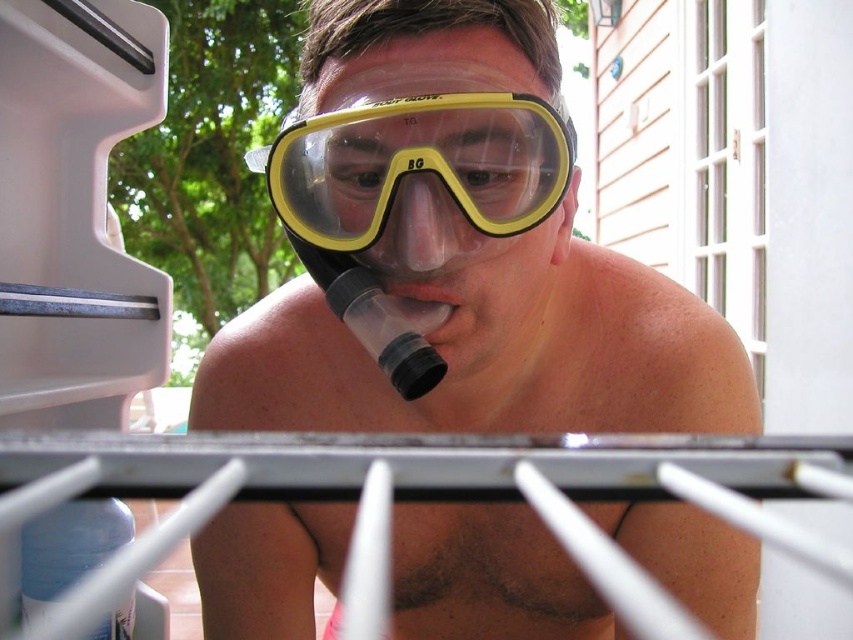
Is yellow clear plastic goggles at center closer to camera compared to translucent rubber nose at center?

No, it is behind translucent rubber nose at center.

Is yellow clear plastic goggles at center to the left of translucent rubber nose at center from the viewer's perspective?

Yes, yellow clear plastic goggles at center is to the left of translucent rubber nose at center.

Identify the location of yellow clear plastic goggles at center. The image size is (853, 640). (418, 164).

Which is more to the right, yellow matte snorkel mask at center or translucent rubber nose at center?

Positioned to the right is translucent rubber nose at center.

Does yellow matte snorkel mask at center have a larger size compared to translucent rubber nose at center?

Indeed, yellow matte snorkel mask at center has a larger size compared to translucent rubber nose at center.

At what (x,y) coordinates should I click in order to perform the action: click on yellow matte snorkel mask at center. Please return your answer as a coordinate pair (x, y). Looking at the image, I should click on (412, 163).

Which is below, clear plastic goggles at center or yellow clear plastic goggles at center?

Positioned lower is clear plastic goggles at center.

Which is more to the right, clear plastic goggles at center or yellow clear plastic goggles at center?

clear plastic goggles at center

Between point (544, 36) and point (438, 132), which one is positioned behind?

The point (544, 36) is more distant.

This screenshot has height=640, width=853. I want to click on clear plastic goggles at center, so click(461, 250).